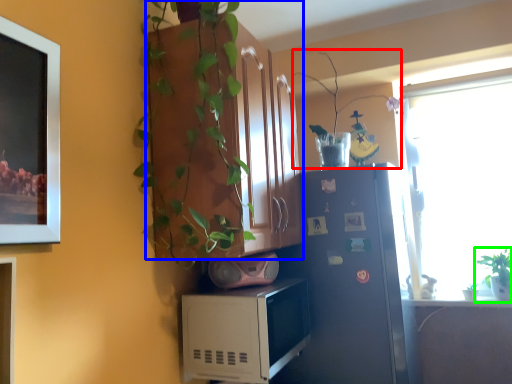
Question: Based on their relative distances, which object is nearer to plant (highlighted by a red box)? Choose from cabinetry (highlighted by a blue box) and houseplant (highlighted by a green box).

Choices:
 (A) cabinetry
 (B) houseplant

Answer: (B)